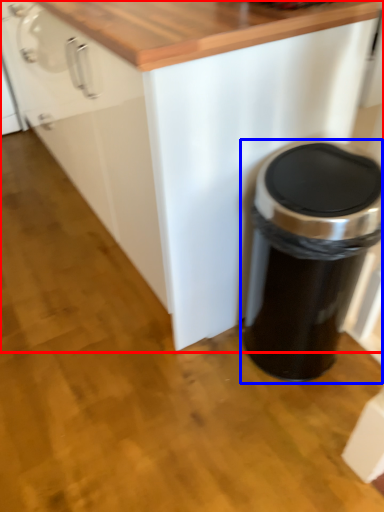
Question: Which object is closer to the camera taking this photo, cabinetry (highlighted by a red box) or waste container (highlighted by a blue box)?

Choices:
 (A) cabinetry
 (B) waste container

Answer: (A)